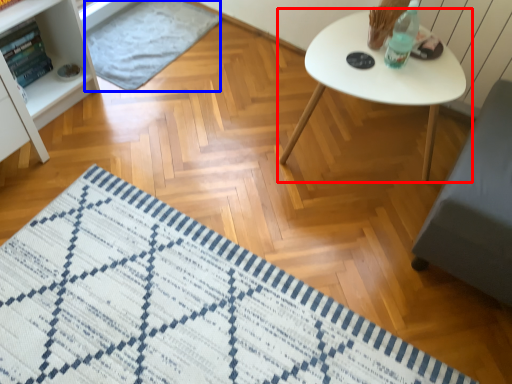
Question: Which of the following is the closest to the observer, table (highlighted by a red box) or mat (highlighted by a blue box)?

Choices:
 (A) table
 (B) mat

Answer: (A)